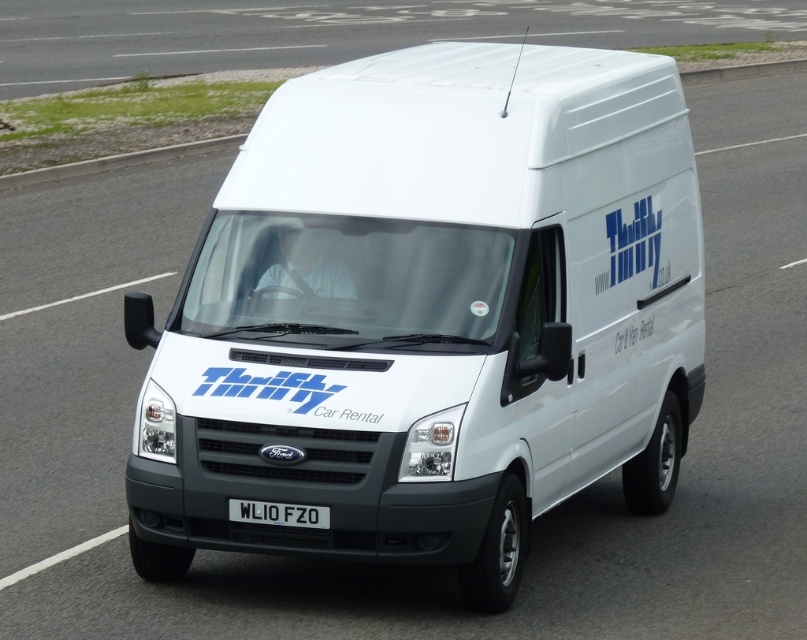
The width and height of the screenshot is (807, 640). What are the coordinates of `white smooth roof at upper center` in the screenshot? It's located at (335, 32).

Does point (228, 4) lie in front of point (312, 513)?

No, it is behind (312, 513).

Locate an element on the screen. white smooth roof at upper center is located at coordinates (335, 32).

What do you see at coordinates (429, 314) in the screenshot?
I see `white matte van at center` at bounding box center [429, 314].

In the scene shown: Does white matte van at center have a greater height compared to black plastic license plate at center?

Yes.

Who is more forward, (571, 316) or (237, 508)?

Point (237, 508) is more forward.

Image resolution: width=807 pixels, height=640 pixels. Identify the location of white matte van at center. (429, 314).

Between white matte van at center and white smooth roof at upper center, which one has more height?

white smooth roof at upper center

Does point (161, 381) come closer to viewer compared to point (655, 26)?

Yes, point (161, 381) is in front of point (655, 26).

Where is `white matte van at center`? Image resolution: width=807 pixels, height=640 pixels. white matte van at center is located at coordinates (429, 314).